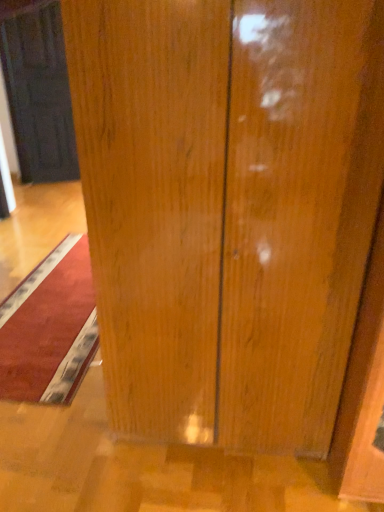
In order to click on matte black door at upper left in this screenshot , I will do `click(38, 90)`.

The height and width of the screenshot is (512, 384). What do you see at coordinates (38, 90) in the screenshot? I see `matte black door at upper left` at bounding box center [38, 90].

Identify the location of matte black door at upper left. (38, 90).